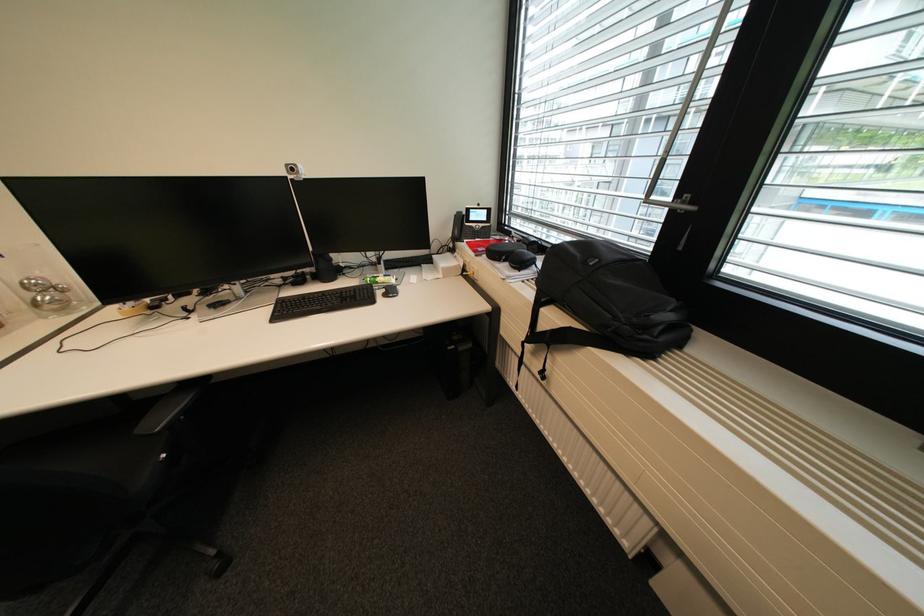
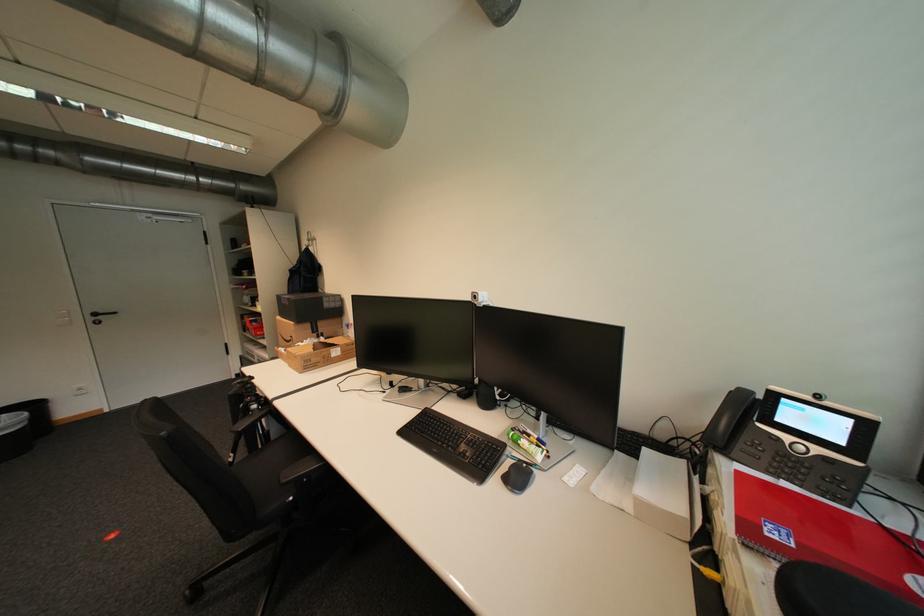
Locate, in the second image, the point that corresponds to (x=282, y=305) in the first image.

(430, 411)